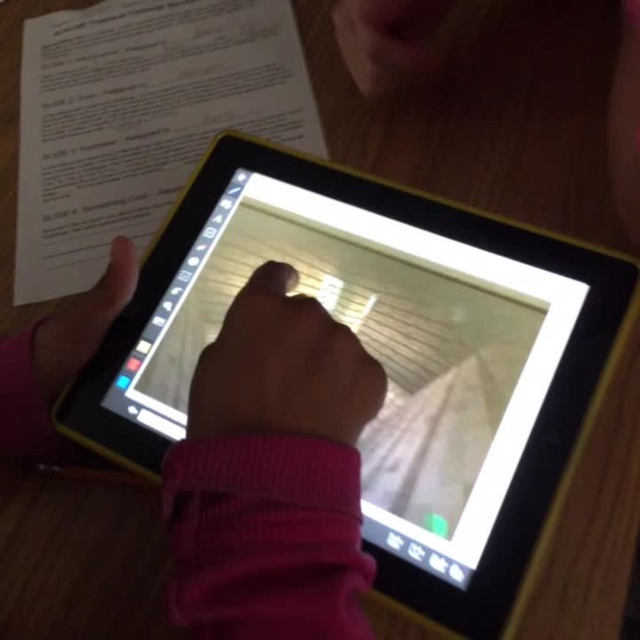
Question: Which point is farther to the camera?

Choices:
 (A) (422, 600)
 (B) (278, 417)
 (C) (182, 493)
 (D) (56, 362)

Answer: (D)

Question: Is black plastic tablet at center below matte black hand at lower left?

Choices:
 (A) no
 (B) yes

Answer: (B)

Question: Which object is the farthest from the black plastic tablet at center?

Choices:
 (A) pink fabric sleeve at center
 (B) matte black hand at lower left
 (C) smooth skin hand at center

Answer: (B)

Question: Among these objects, which one is farthest from the camera?

Choices:
 (A) matte black hand at lower left
 (B) pink fabric sleeve at center

Answer: (A)

Question: Is pink fabric sleeve at center below matte black hand at lower left?

Choices:
 (A) yes
 (B) no

Answer: (A)

Question: Does black plastic tablet at center lie in front of pink fabric sleeve at center?

Choices:
 (A) yes
 (B) no

Answer: (B)